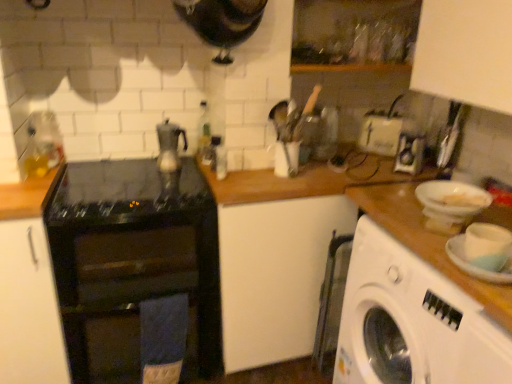
Question: Do you think metallic silver kettle at center, the 1th appliance viewed from the left, is within white plastic toaster at center, which is the 2th appliance in front-to-back order, or outside of it?

Choices:
 (A) inside
 (B) outside

Answer: (B)

Question: In the image, is metallic silver kettle at center, the 1th appliance viewed from the left, on the left side or the right side of white plastic toaster at center, which is the 2th appliance in front-to-back order?

Choices:
 (A) right
 (B) left

Answer: (B)

Question: Considering the real-world distances, which object is closest to the black glass stove at center?

Choices:
 (A) transparent glass bottle at upper center
 (B) satin silver teapot at center
 (C) metallic silver kettle at center, the 1th appliance viewed from the left
 (D) black glossy cabinet at left
 (E) white matte plate at right

Answer: (D)

Question: Considering the real-world distances, which object is closest to the white matte plate at right?

Choices:
 (A) black glossy cabinet at left
 (B) black glass stove at center
 (C) black glass gas stove at center
 (D) transparent glass bottle at upper center
 (E) satin silver teapot at center

Answer: (D)